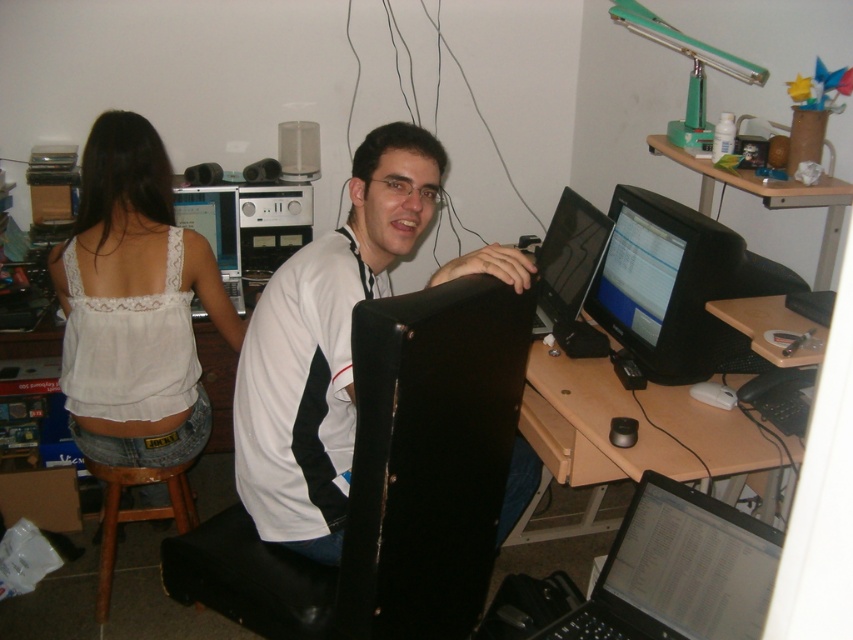
Who is taller, black leather chair at center or matte black monitor at center?

Standing taller between the two is black leather chair at center.

Between black leather chair at center and matte black monitor at center, which one is positioned higher?

Positioned higher is matte black monitor at center.

Identify the location of black leather chair at center. (392, 481).

The height and width of the screenshot is (640, 853). Find the location of `black leather chair at center`. black leather chair at center is located at coordinates (392, 481).

Is white matte shirt at center bigger than white lace tank top at upper left?

Yes.

Who is more distant from viewer, (395, 237) or (131, 362)?

Positioned behind is point (131, 362).

Find the location of a particular element. This screenshot has height=640, width=853. white matte shirt at center is located at coordinates click(323, 346).

Identify the location of white matte shirt at center. (323, 346).

Where is `white matte shirt at center`? This screenshot has width=853, height=640. white matte shirt at center is located at coordinates (323, 346).

Is point (344, 336) farther from camera compared to point (115, 541)?

No.

Is point (531, 460) farther from camera compared to point (122, 509)?

No, it is not.

The height and width of the screenshot is (640, 853). What are the coordinates of `white matte shirt at center` in the screenshot? It's located at (323, 346).